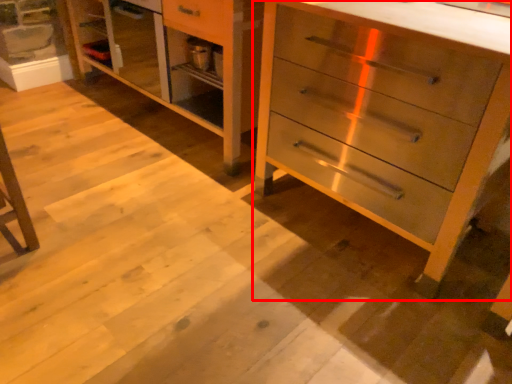
Question: Where is chest of drawers (annotated by the red box) located in relation to dresser in the image?

Choices:
 (A) left
 (B) right

Answer: (B)